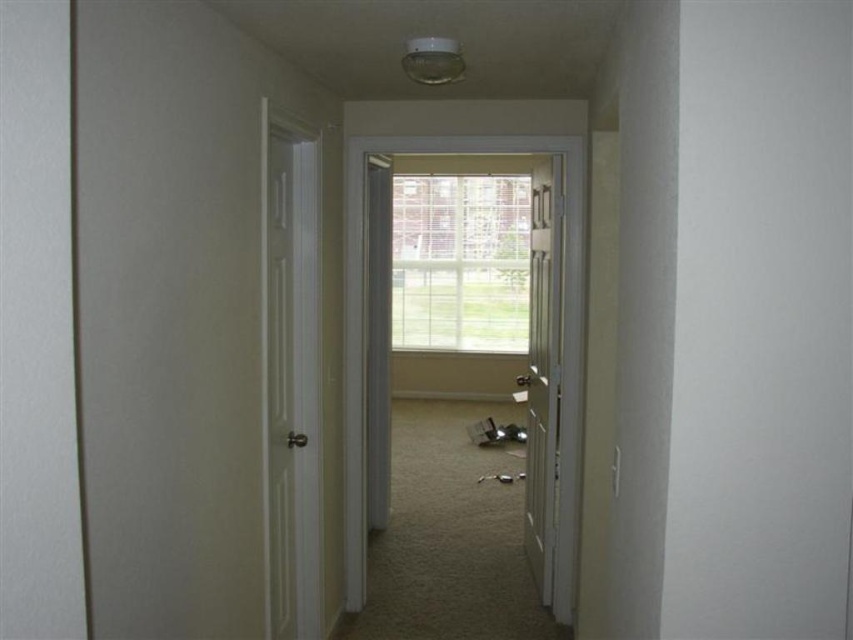
Question: Does white smooth door at left appear on the right side of clear glass window at center?

Choices:
 (A) no
 (B) yes

Answer: (A)

Question: Considering the relative positions of clear glass window at center and white wood door at center in the image provided, where is clear glass window at center located with respect to white wood door at center?

Choices:
 (A) below
 (B) above

Answer: (B)

Question: Which point is farther from the camera taking this photo?

Choices:
 (A) (287, 524)
 (B) (544, 496)
 (C) (405, 308)

Answer: (C)

Question: Which of the following is the closest to the observer?

Choices:
 (A) white wood door at center
 (B) clear glass window at center

Answer: (A)

Question: Among these objects, which one is nearest to the camera?

Choices:
 (A) white smooth door at left
 (B) white wood door at center
 (C) clear glass window at center

Answer: (A)

Question: Can you confirm if clear glass window at center is positioned below white wood door at center?

Choices:
 (A) yes
 (B) no

Answer: (B)